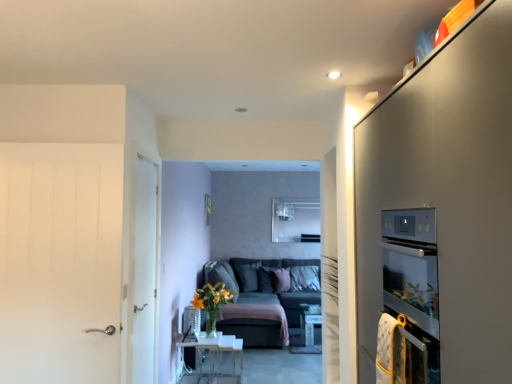
Question: Can you confirm if dark gray fabric couch at center is wider than white matte door at left, the 1th door in the left-to-right sequence?

Choices:
 (A) yes
 (B) no

Answer: (A)

Question: Can you see dark gray fabric couch at center touching white matte door at left, positioned as the second door in right-to-left order?

Choices:
 (A) no
 (B) yes

Answer: (A)

Question: Considering the relative sizes of dark gray fabric couch at center and white matte door at left, positioned as the 1th door in front-to-back order, in the image provided, is dark gray fabric couch at center smaller than white matte door at left, positioned as the 1th door in front-to-back order,?

Choices:
 (A) yes
 (B) no

Answer: (B)

Question: Does dark gray fabric couch at center appear on the right side of white matte door at left, which is counted as the 2th door, starting from the back?

Choices:
 (A) no
 (B) yes

Answer: (B)

Question: Is dark gray fabric couch at center positioned with its back to white matte door at left, the 1th door in the left-to-right sequence?

Choices:
 (A) yes
 (B) no

Answer: (B)

Question: Can you confirm if dark gray fabric couch at center is bigger than white matte door at left, positioned as the second door in right-to-left order?

Choices:
 (A) no
 (B) yes

Answer: (B)

Question: Considering the relative sizes of velvet dark gray pillow at center, which appears as the first pillow when viewed from the left, and clear glass table at lower center in the image provided, is velvet dark gray pillow at center, which appears as the first pillow when viewed from the left, bigger than clear glass table at lower center?

Choices:
 (A) yes
 (B) no

Answer: (A)

Question: From the image's perspective, is velvet dark gray pillow at center, which appears as the 3th pillow when viewed from the right, beneath clear glass table at lower center?

Choices:
 (A) no
 (B) yes

Answer: (A)

Question: Can you confirm if velvet dark gray pillow at center, which appears as the 3th pillow when viewed from the right, is thinner than clear glass table at lower center?

Choices:
 (A) yes
 (B) no

Answer: (B)

Question: Considering the relative sizes of velvet dark gray pillow at center, which appears as the 3th pillow when viewed from the right, and clear glass table at lower center in the image provided, is velvet dark gray pillow at center, which appears as the 3th pillow when viewed from the right, smaller than clear glass table at lower center?

Choices:
 (A) yes
 (B) no

Answer: (B)

Question: Is the depth of velvet dark gray pillow at center, which appears as the first pillow when viewed from the left, less than that of clear glass table at lower center?

Choices:
 (A) no
 (B) yes

Answer: (A)

Question: Is velvet dark gray pillow at center, which appears as the 3th pillow when viewed from the right, turned away from white wood door at left, the first door from the right?

Choices:
 (A) no
 (B) yes

Answer: (A)